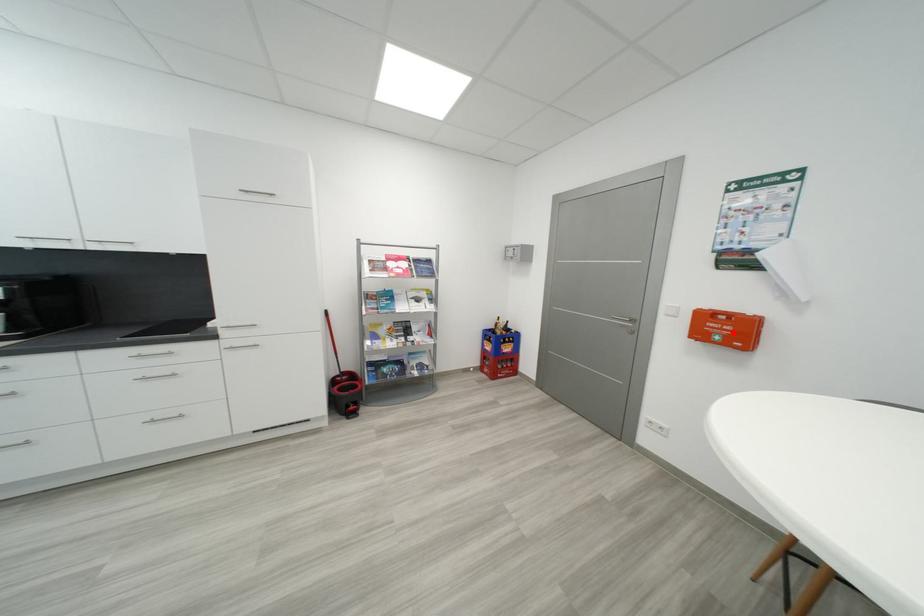
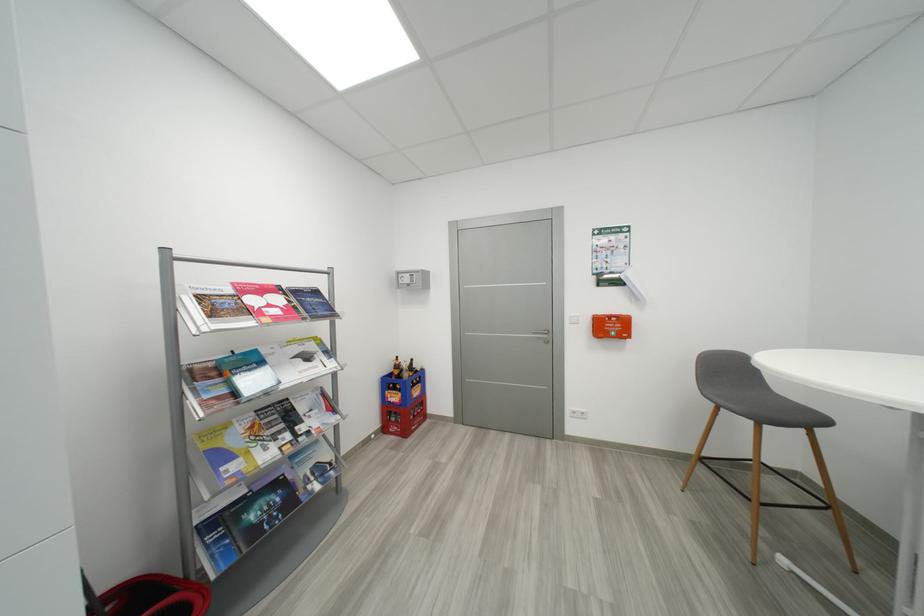
Find the pixel in the second image that matches the highlighted location in the first image.

(617, 330)